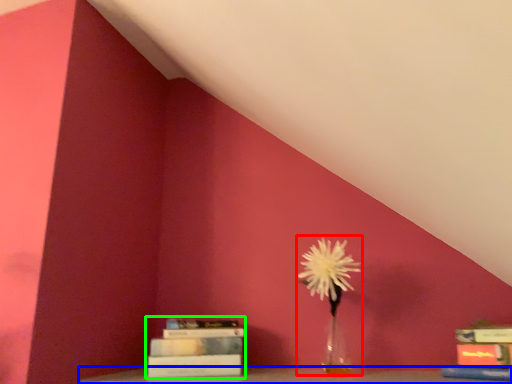
Question: Estimate the real-world distances between objects in this image. Which object is closer to floral arrangement (highlighted by a red box), furniture (highlighted by a blue box) or book (highlighted by a green box)?

Choices:
 (A) furniture
 (B) book

Answer: (A)